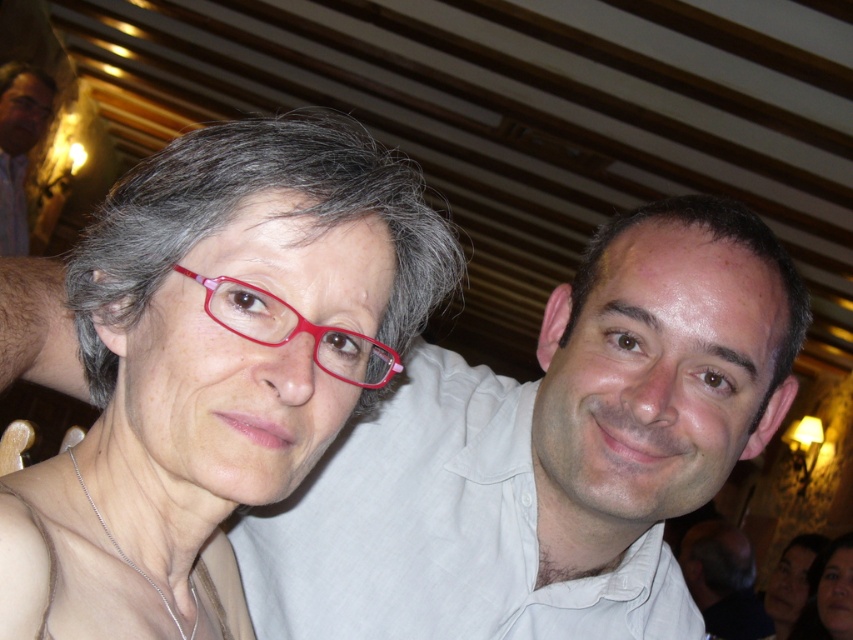
Question: Is matte black shirt at upper left smaller than smooth skin face at lower right?

Choices:
 (A) no
 (B) yes

Answer: (A)

Question: Considering the real-world distances, which object is closest to the smooth skin face at lower right?

Choices:
 (A) matte black shirt at upper left
 (B) white smooth shirt at center
 (C) matte black hair at lower right

Answer: (C)

Question: Considering the relative positions of smooth white shirt at center and matte black shirt at upper left in the image provided, where is smooth white shirt at center located with respect to matte black shirt at upper left?

Choices:
 (A) below
 (B) above

Answer: (A)

Question: Which point is farther to the camera?

Choices:
 (A) (6, 192)
 (B) (289, 237)
 (C) (398, 356)

Answer: (A)

Question: Which object appears closest to the camera in this image?

Choices:
 (A) matte plastic glasses at center
 (B) smooth white shirt at center
 (C) matte black shirt at upper left

Answer: (A)

Question: From the image, what is the correct spatial relationship of smooth white shirt at center in relation to matte black shirt at upper left?

Choices:
 (A) below
 (B) above

Answer: (A)